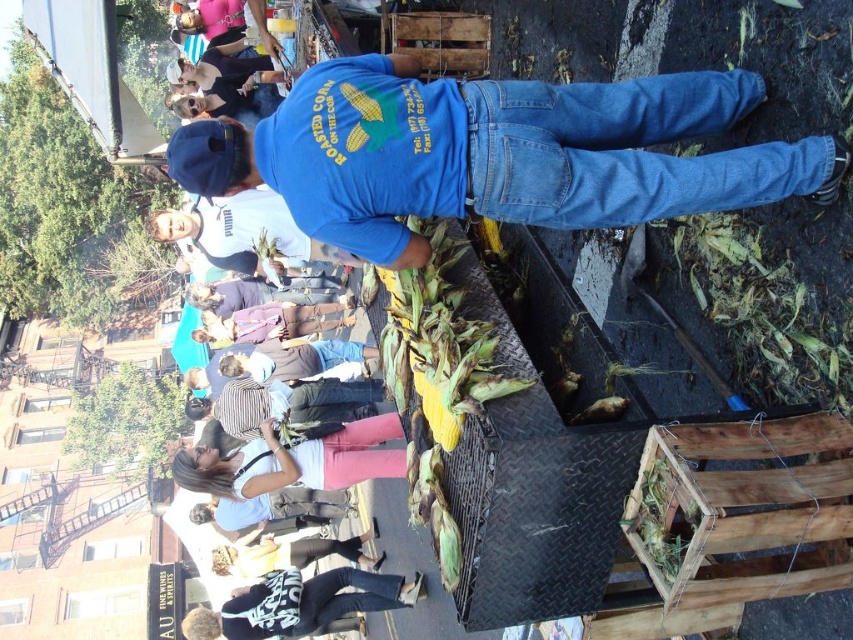
Question: Is blue denim jeans at center wider than black and white printed shirt at lower center?

Choices:
 (A) yes
 (B) no

Answer: (B)

Question: Does denim pants at lower center appear under matte blue shirt at upper center?

Choices:
 (A) no
 (B) yes

Answer: (B)

Question: Based on their relative distances, which object is nearer to the black and white printed shirt at lower center?

Choices:
 (A) denim jacket at lower center
 (B) denim pants at lower center

Answer: (A)

Question: Which point is farther to the camera?

Choices:
 (A) blue denim jeans at center
 (B) denim pants at lower center
 (C) black and white printed shirt at lower center
 (D) denim jacket at lower center

Answer: (B)

Question: Which point is closer to the camera?

Choices:
 (A) (407, 595)
 (B) (498, 173)
 (C) (354, 552)
 (D) (294, 515)

Answer: (B)

Question: Can you confirm if black and white printed shirt at lower center is positioned to the left of matte blue shirt at upper center?

Choices:
 (A) yes
 (B) no

Answer: (B)